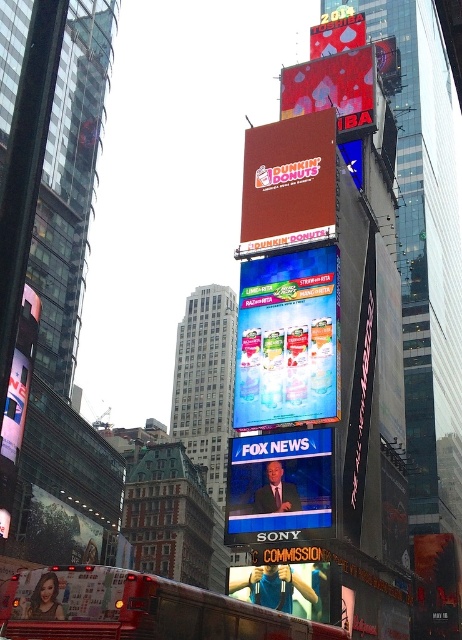
Question: Which is nearer to the red fabric sign at upper center?

Choices:
 (A) matte blue screen at center
 (B) blue fabric at lower center

Answer: (A)

Question: Is matte red sign at center below matte blue screen at center?

Choices:
 (A) no
 (B) yes

Answer: (A)

Question: Which object is the farthest from the matte black bus at left?

Choices:
 (A) matte red sign at center
 (B) shiny plastic bottles at center
 (C) blue fabric at lower center

Answer: (C)

Question: Does shiny plastic bottles at center have a smaller size compared to matte blue screen at center?

Choices:
 (A) yes
 (B) no

Answer: (B)

Question: Does shiny plastic bottles at center have a larger size compared to red fabric sign at upper center?

Choices:
 (A) no
 (B) yes

Answer: (A)

Question: Which object is farther from the camera taking this photo?

Choices:
 (A) shiny red billboard at upper center
 (B) red fabric sign at upper center

Answer: (B)